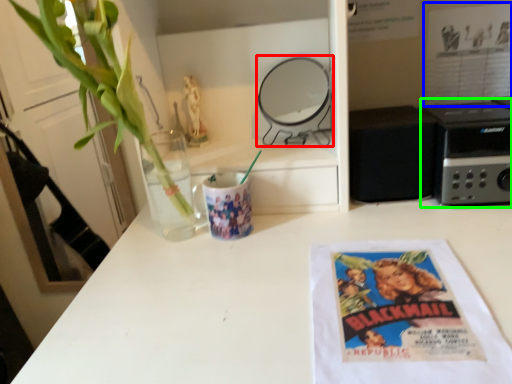
Question: Which is nearer to the appliance (highlighted by a red box)? movie poster (highlighted by a blue box) or appliance (highlighted by a green box).

Choices:
 (A) movie poster
 (B) appliance

Answer: (B)